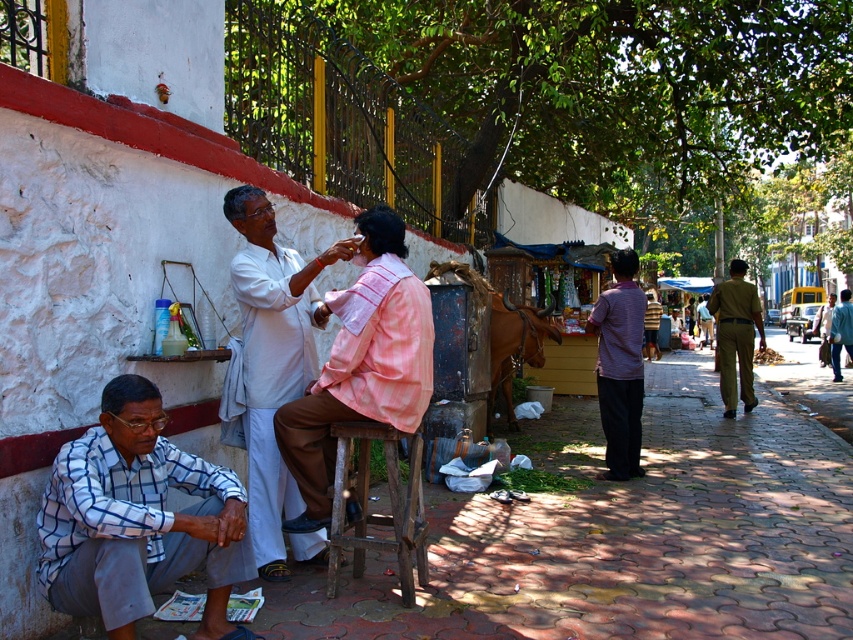
In the scene shown: Between white checkered shirt at lower left and purple cotton shirt at center, which one has more height?

purple cotton shirt at center

Can you confirm if white checkered shirt at lower left is smaller than purple cotton shirt at center?

Yes, white checkered shirt at lower left is smaller than purple cotton shirt at center.

Locate an element on the screen. This screenshot has width=853, height=640. white checkered shirt at lower left is located at coordinates (137, 518).

Does pink woven fabric at center appear on the left side of blue shirt at center?

Correct, you'll find pink woven fabric at center to the left of blue shirt at center.

At what (x,y) coordinates should I click in order to perform the action: click on pink woven fabric at center. Please return your answer as a coordinate pair (x, y). Looking at the image, I should click on (361, 364).

Where is `pink woven fabric at center`? The image size is (853, 640). pink woven fabric at center is located at coordinates (361, 364).

Does point (329, 540) lie behind point (619, 403)?

No, it is in front of (619, 403).

Is wooden stool at center positioned at the back of purple cotton shirt at center?

That is False.

Locate an element on the screen. Image resolution: width=853 pixels, height=640 pixels. wooden stool at center is located at coordinates (376, 513).